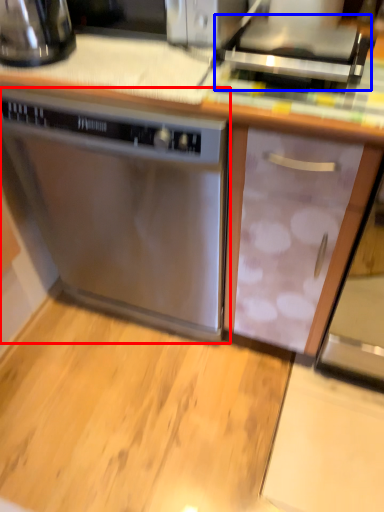
Question: Among these objects, which one is nearest to the camera, home appliance (highlighted by a red box) or appliance (highlighted by a blue box)?

Choices:
 (A) home appliance
 (B) appliance

Answer: (B)